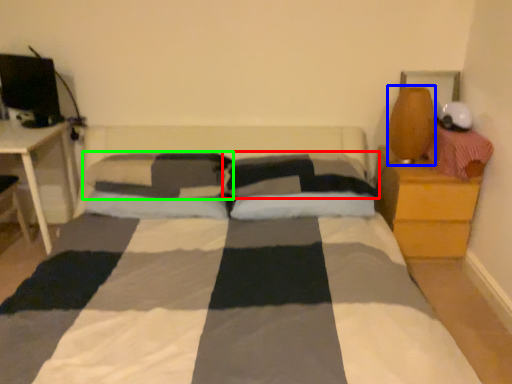
Question: Which object is positioned farthest from pillow (highlighted by a red box)? Select from table lamp (highlighted by a blue box) and pillow (highlighted by a green box).

Choices:
 (A) table lamp
 (B) pillow

Answer: (A)